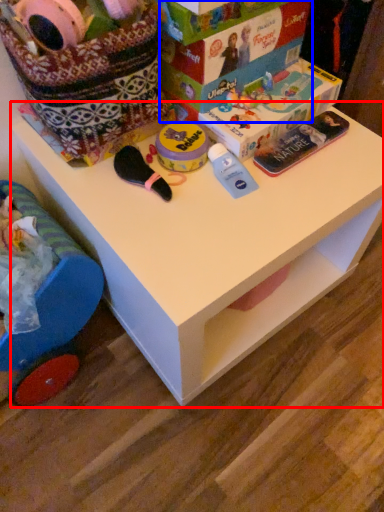
Question: Which point is closer to the camera, table (highlighted by a red box) or storage box (highlighted by a blue box)?

Choices:
 (A) table
 (B) storage box

Answer: (A)